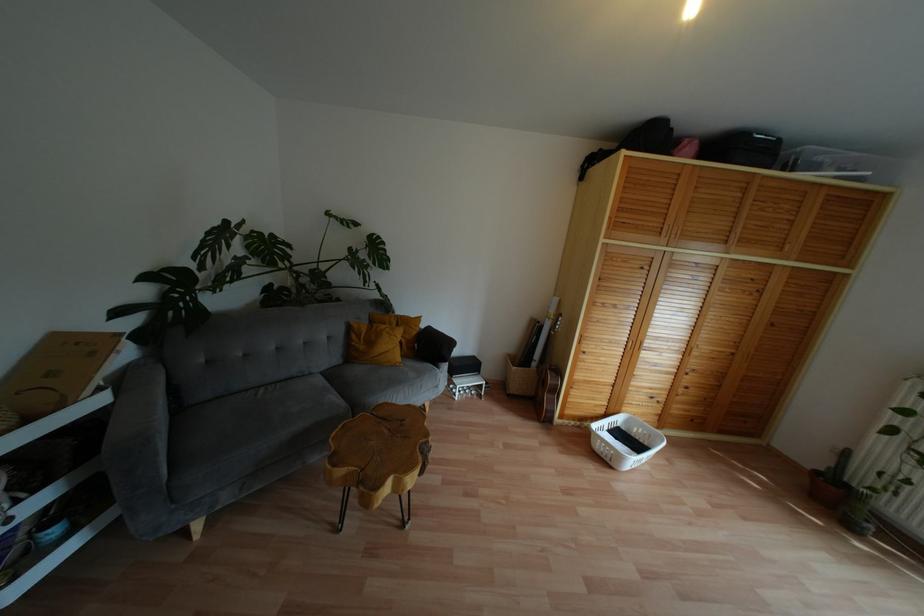
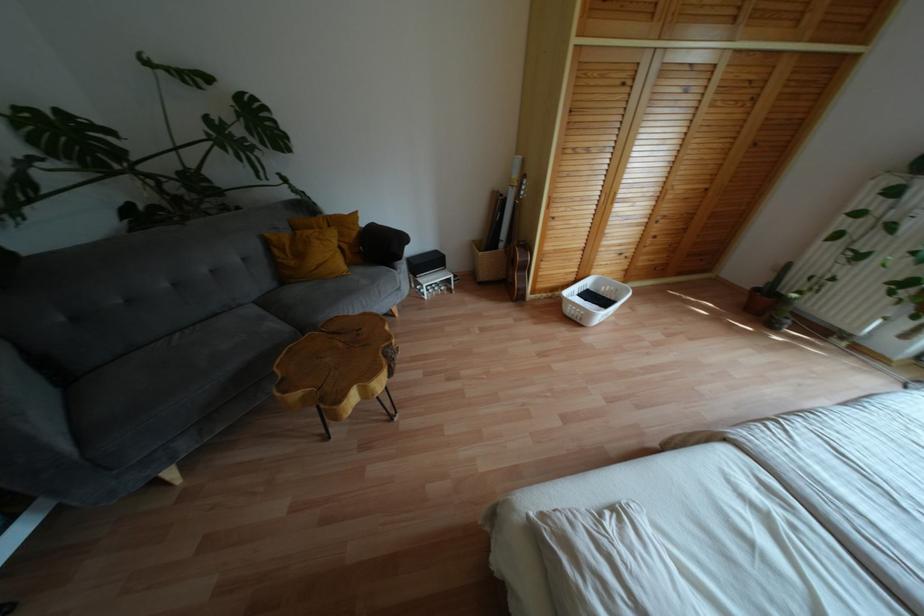
Where in the second image is the point corresponding to point 385,431 from the first image?

(341, 344)